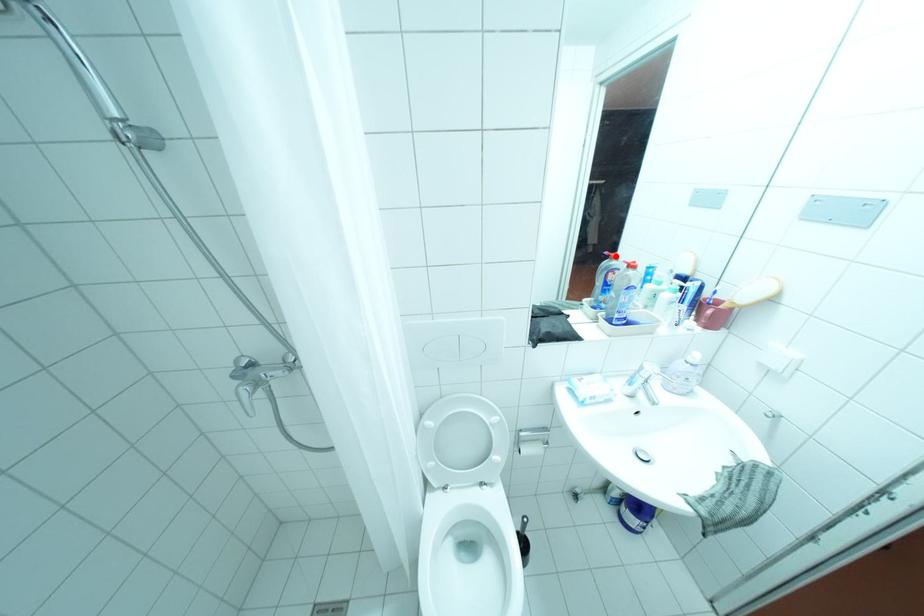
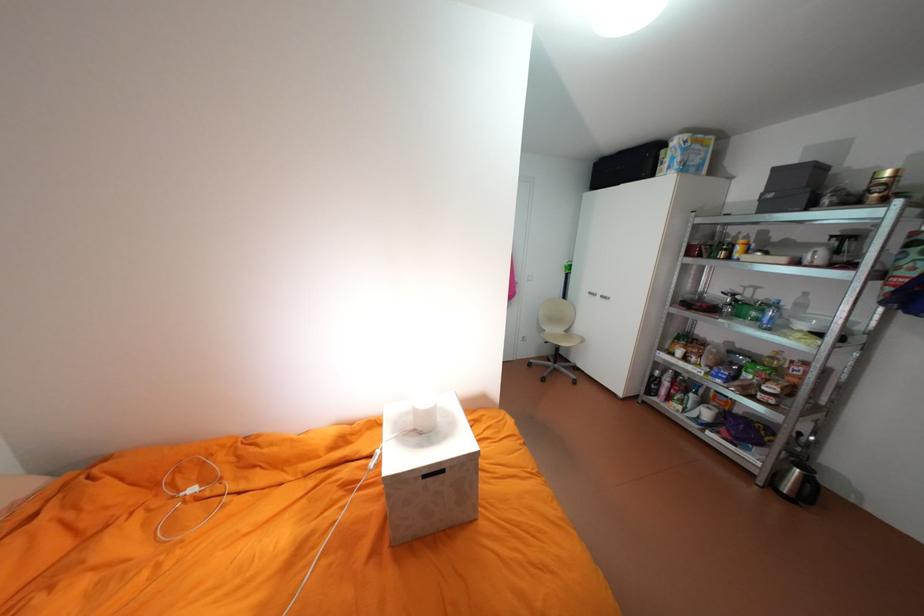
Question: I am providing you with two images of the same scene from different viewpoints. A red point is marked on the first image. At the location where the point appears in image 1, is it still visible in image 2?

Choices:
 (A) Yes
 (B) No

Answer: (B)